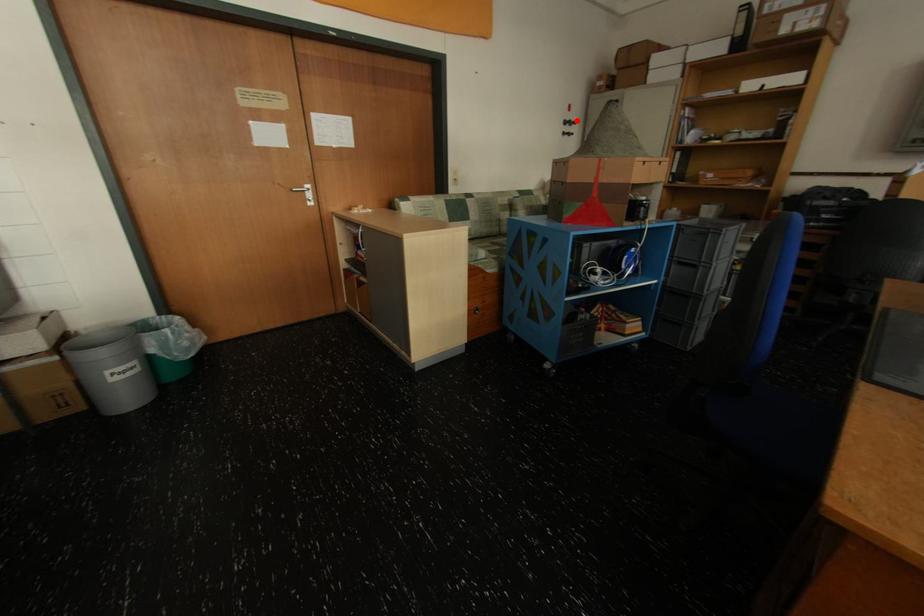
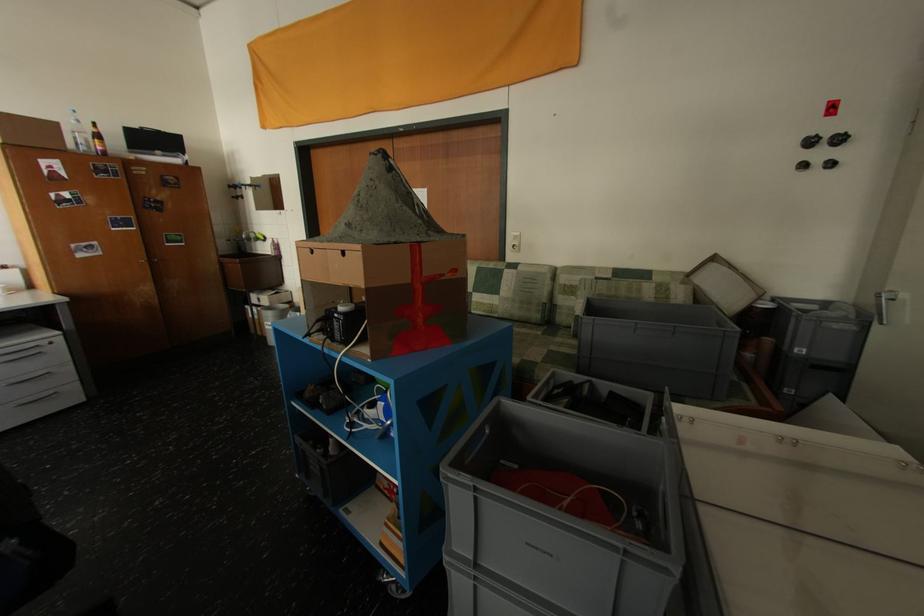
In the second image, find the point that corresponds to the highlighted location in the first image.

(821, 137)